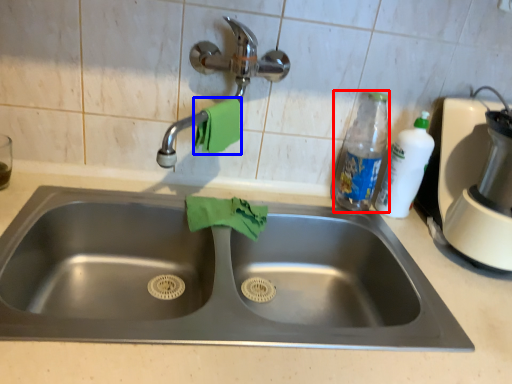
Question: Which point is further to the camera, bottle (highlighted by a red box) or hand towel (highlighted by a blue box)?

Choices:
 (A) bottle
 (B) hand towel

Answer: (A)